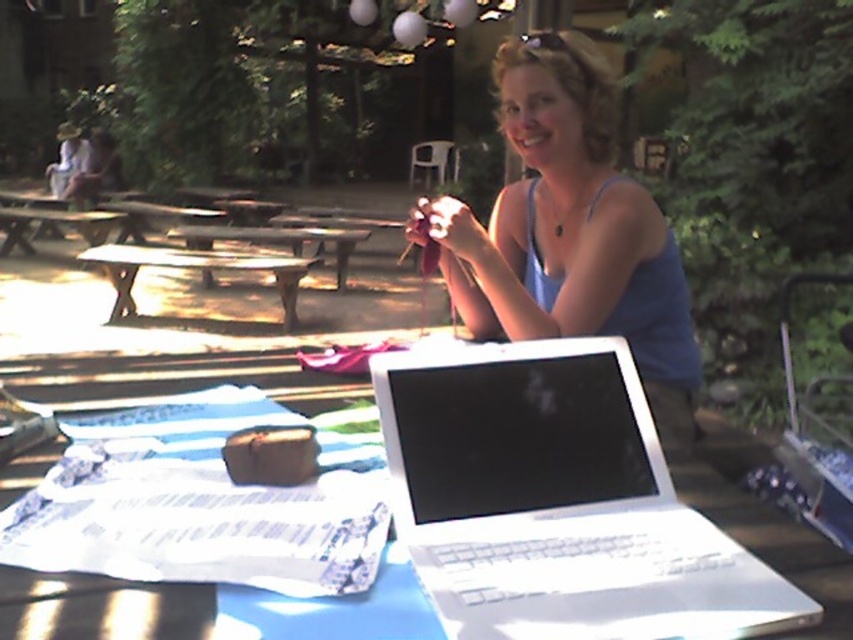
You are standing at the picnic table in the park scene. You notice a point marked at coordinates (570,228). What object is located at this point?

The point at coordinates (570,228) corresponds to the blue fabric tank top at center.

You are standing at the entrance of the park and want to locate the white plastic table at center. According to the coordinates provided, in which direction should you walk to reach it?

The white plastic table at center is located at coordinates point [207,609]. Since the x coordinate is 0.952, which is closer to 1, you should walk towards the right side of the frame to reach it.